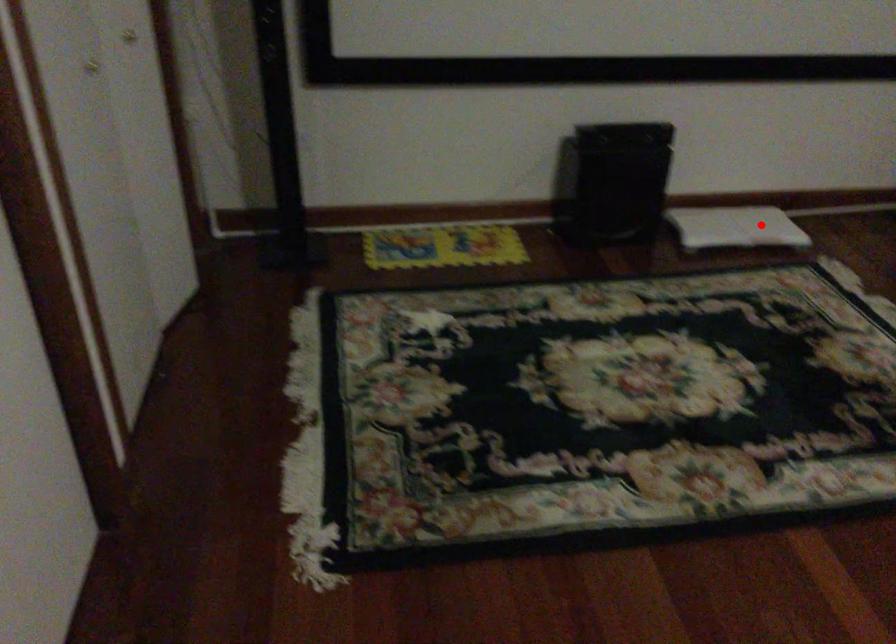
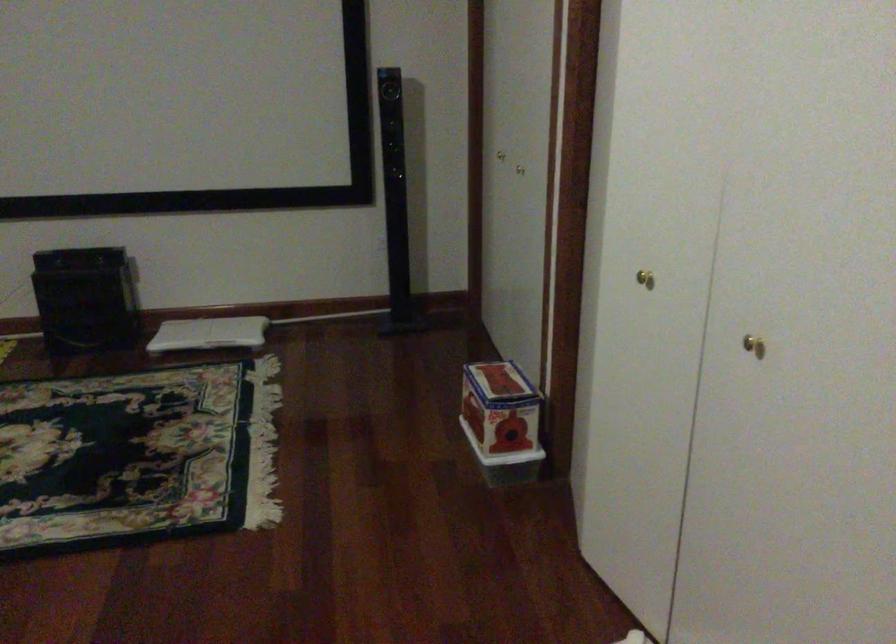
Where in the second image is the point corresponding to the highlighted location from the first image?

(209, 333)